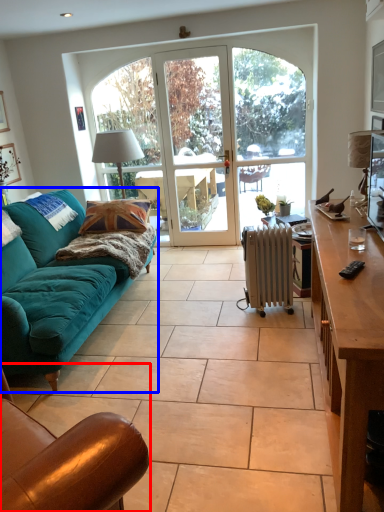
Question: Which point is closer to the camera, chair (highlighted by a red box) or studio couch (highlighted by a blue box)?

Choices:
 (A) chair
 (B) studio couch

Answer: (A)